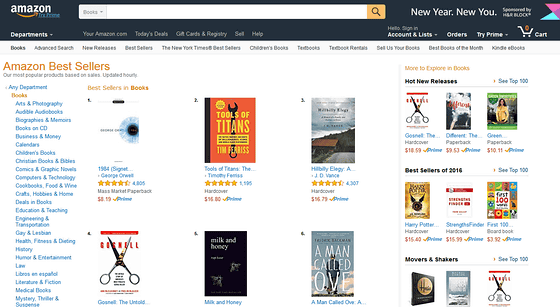
This screenshot has width=560, height=307. Find the location of `small book covers on right side`. small book covers on right side is located at coordinates (419, 113), (464, 108), (500, 108), (507, 194), (459, 201), (414, 202), (426, 280), (458, 280), (501, 291).